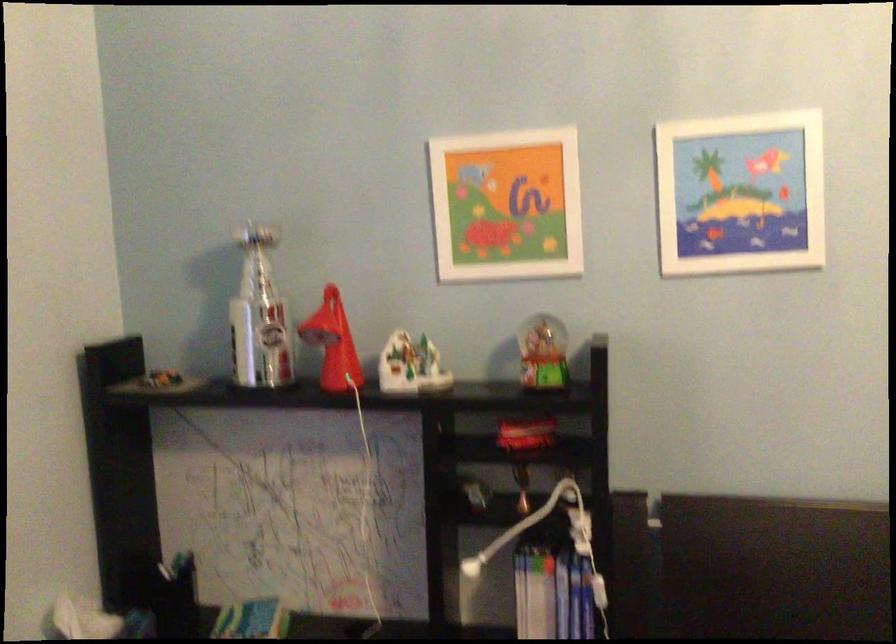
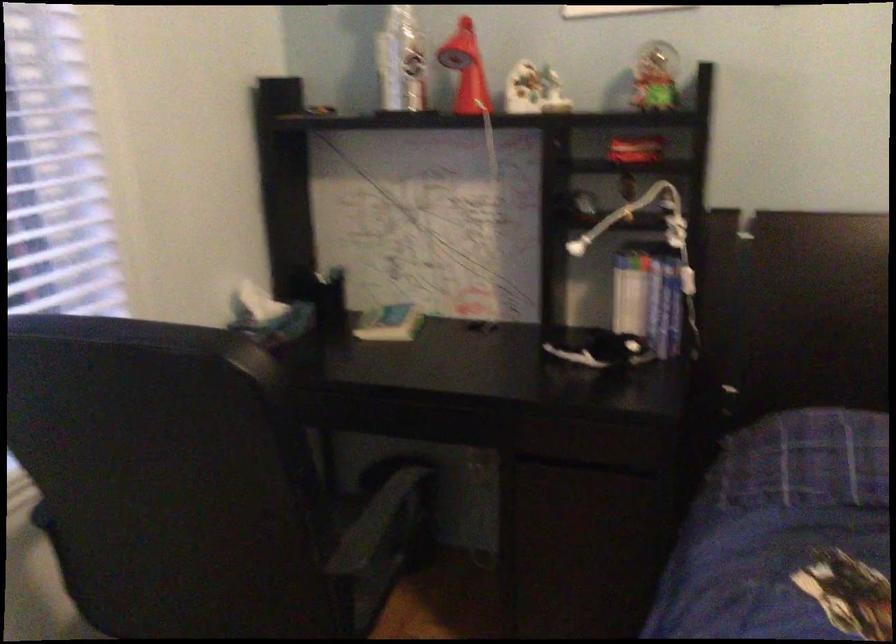
Find the pixel in the second image that matches the point at 471,567 in the first image.

(576, 247)